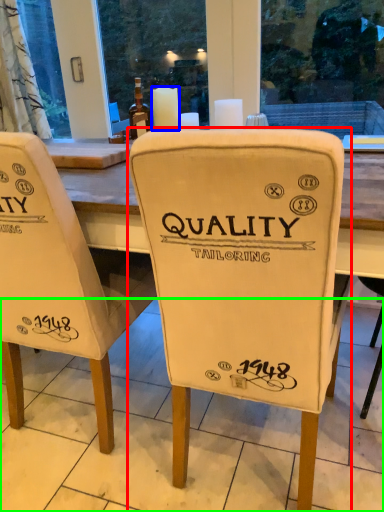
Question: Which is nearer to the chair (highlighted by a red box)? candle (highlighted by a blue box) or tile (highlighted by a green box).

Choices:
 (A) candle
 (B) tile

Answer: (B)